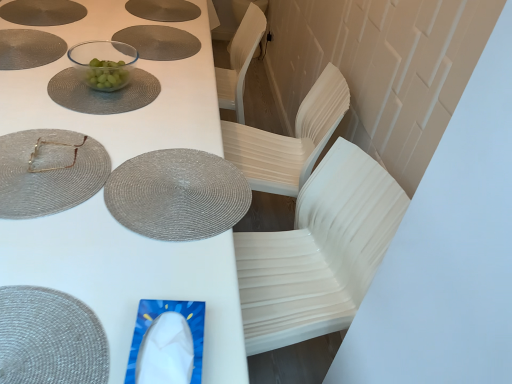
Identify the location of vacant space in matte woven placemat at upper left, positioned as the second glass plate in back-to-front order (from a real-world perspective). (37, 165).